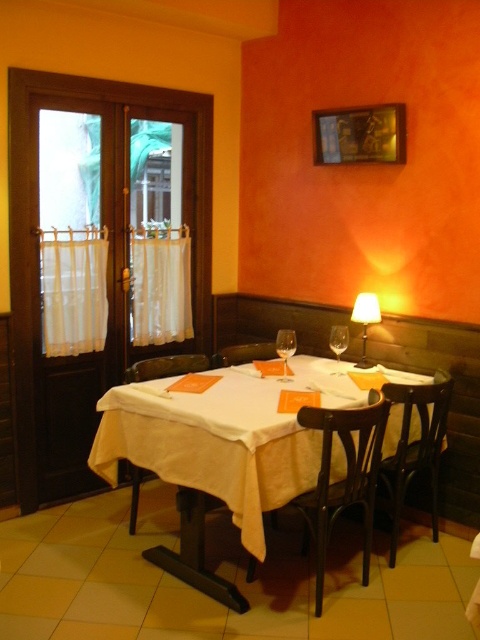
In the scene shown: Does white matte table at center have a larger size compared to dark wood chair at center?

Yes.

Is white matte table at center further to the viewer compared to dark wood chair at center?

No.

Which is in front, point (195, 452) or point (370, 536)?

Positioned in front is point (195, 452).

Image resolution: width=480 pixels, height=640 pixels. Find the location of `white matte table at center`. white matte table at center is located at coordinates (210, 460).

Can you confirm if white matte table at center is positioned below brown wooden chair at center?

Indeed, white matte table at center is positioned under brown wooden chair at center.

Does white matte table at center appear over brown wooden chair at center?

No, white matte table at center is not above brown wooden chair at center.

Locate an element on the screen. The image size is (480, 640). white matte table at center is located at coordinates pos(210,460).

This screenshot has height=640, width=480. In order to click on white matte table at center in this screenshot , I will do `click(210, 460)`.

Is white matte table at center positioned in front of dark brown wooden chair at lower right?

Yes, white matte table at center is in front of dark brown wooden chair at lower right.

What do you see at coordinates (210, 460) in the screenshot?
I see `white matte table at center` at bounding box center [210, 460].

Find the location of a particular element. white matte table at center is located at coordinates (210, 460).